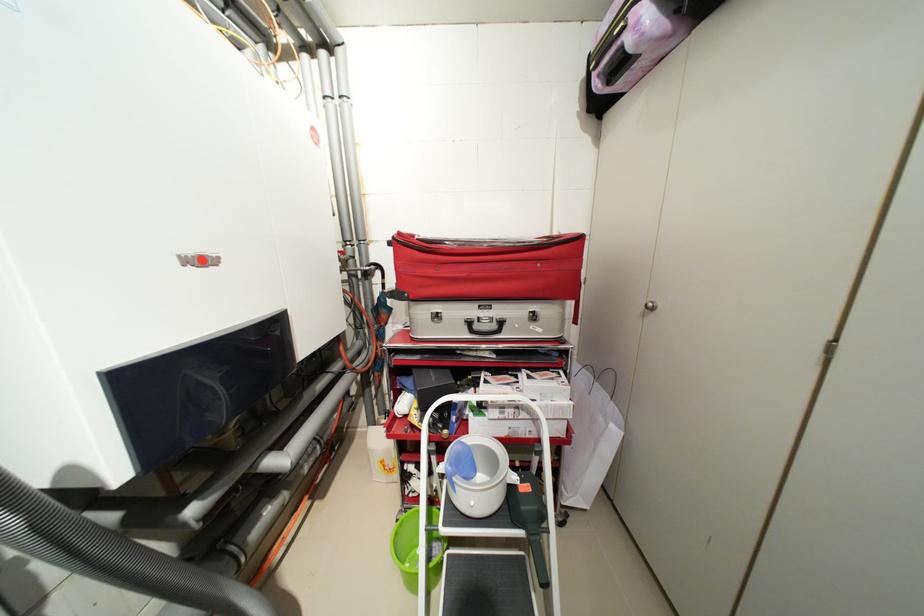
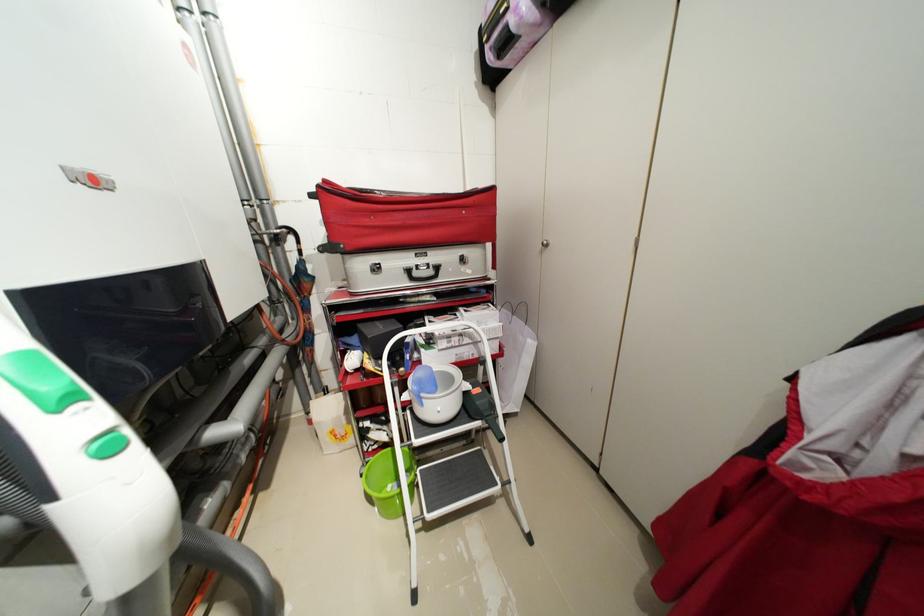
The point at (570,436) is marked in the first image. Where is the corresponding point in the second image?

(505, 352)